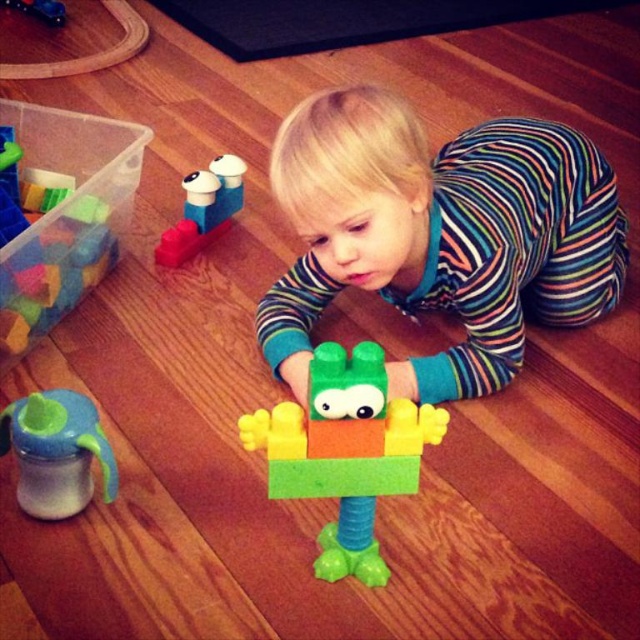
You are a photographer taking a picture of the play area. You notice two points in the scene labeled as point (x=340, y=561) and point (x=182, y=212). Which point should you focus on to ensure it appears larger in the photo?

Point (x=340, y=561) is closer to the camera than point (x=182, y=212), so focusing on point (x=340, y=561) will make it appear larger in the photo.

You are a parent observing your child playing with the green matte plastic toy at center and the matte plastic train at upper left. Which object is closer to the child?

The green matte plastic toy at center is closer to the child because it is positioned below the matte plastic train at upper left, indicating it is lower and nearer in the scene.

You are a parent standing in the room and want to place a toy on the floor near the child. The toy requires a space that is at least 40 inches away from the viewer to avoid being stepped on. Is the point at coordinates point [72,438] suitable for placing the toy?

The distance of point [72,438] from viewer is 39.31 inches, which is less than the required 40 inches. Therefore, placing the toy there might risk it being stepped on.